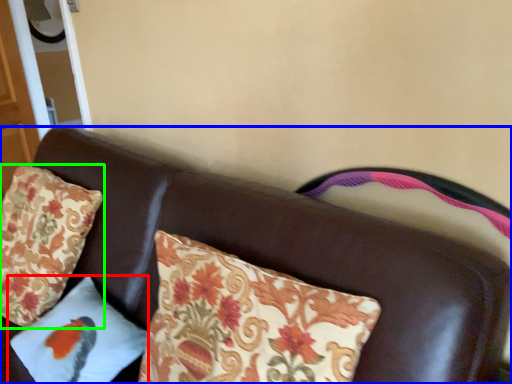
Question: Based on their relative distances, which object is farther from pillow (highlighted by a red box)? Choose from furniture (highlighted by a blue box) and pillow (highlighted by a green box).

Choices:
 (A) furniture
 (B) pillow

Answer: (B)